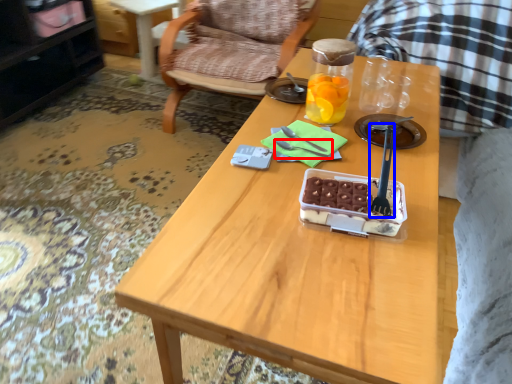
Question: Which point is closer to the camera, fork (highlighted by a red box) or fork (highlighted by a blue box)?

Choices:
 (A) fork
 (B) fork

Answer: (B)